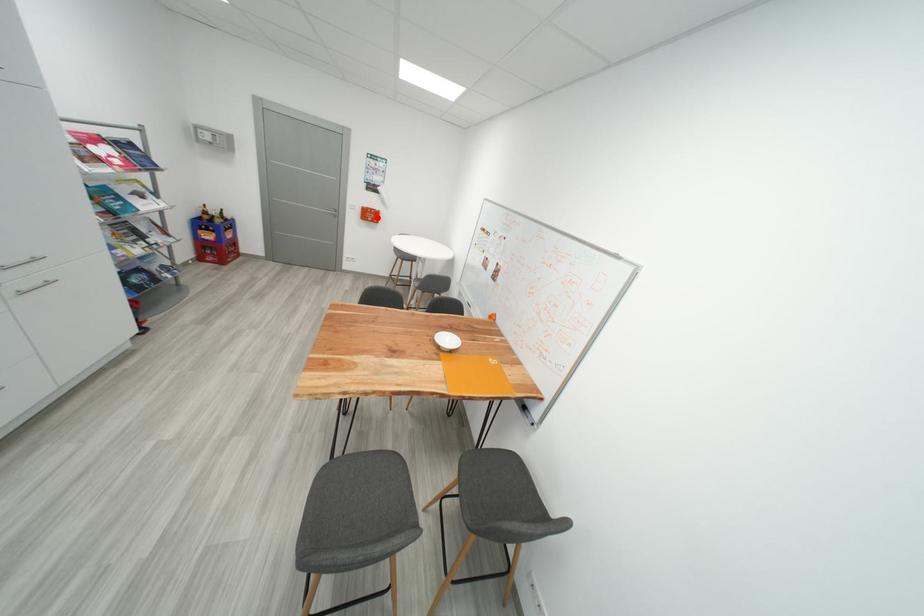
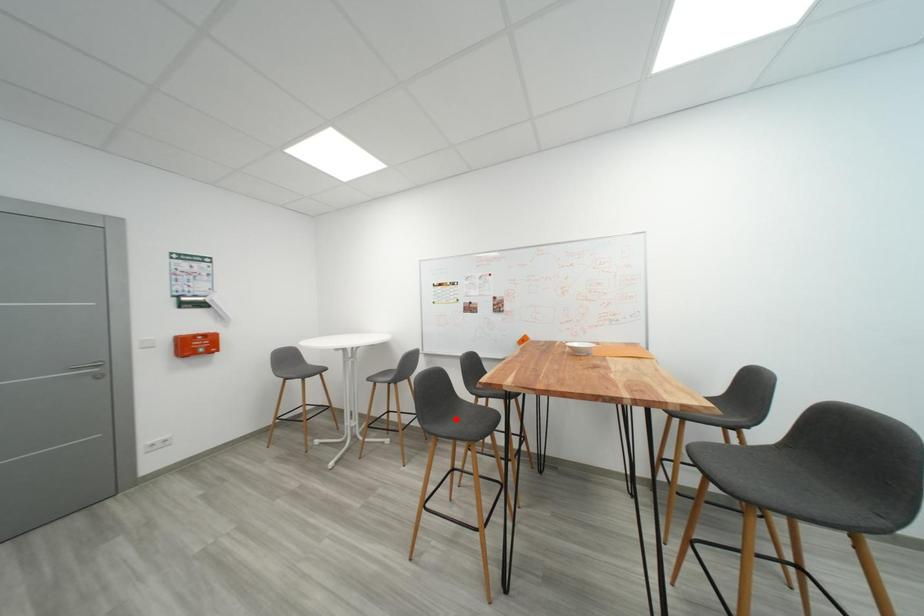
I am providing you with two images of the same scene from different viewpoints. A red point is marked on the first image and another point is marked on the second image. Do the highlighted points in image1 and image2 indicate the same real-world spot?

No